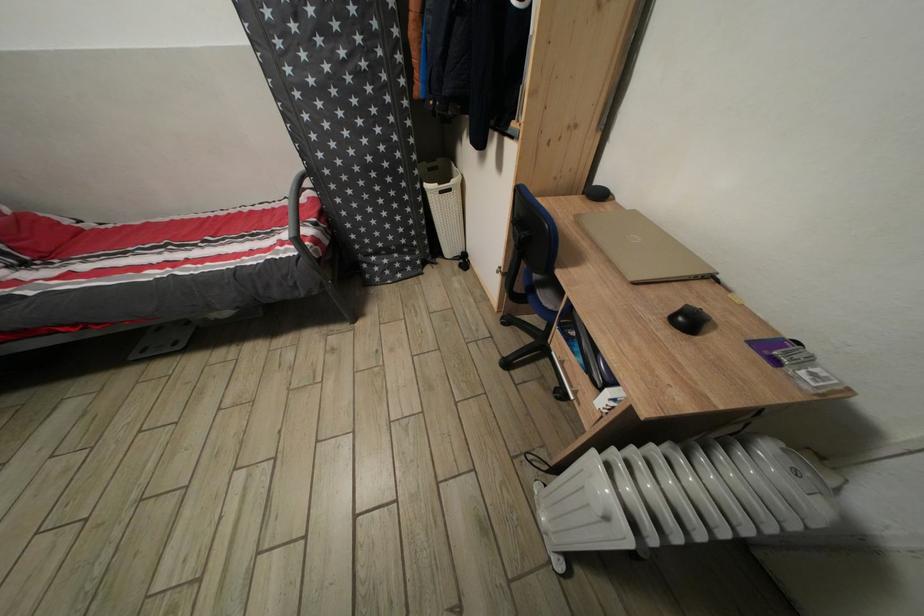
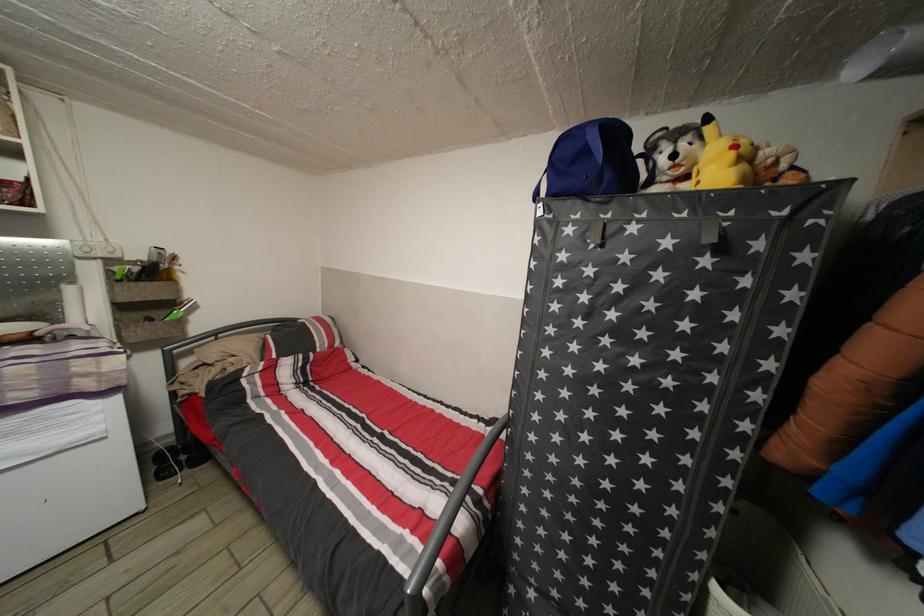
The point at [432,192] is marked in the first image. Where is the corresponding point in the second image?

(723, 594)